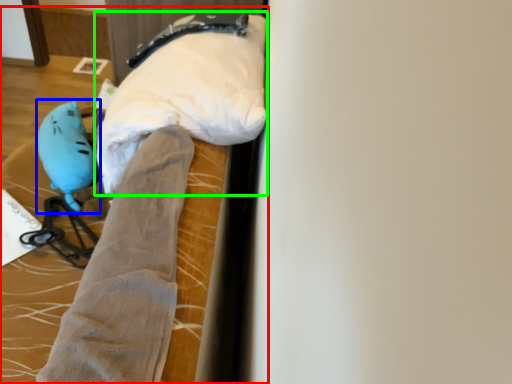
Question: Based on their relative distances, which object is farther from bed (highlighted by a red box)? Choose from toy (highlighted by a blue box) and wide (highlighted by a green box).

Choices:
 (A) toy
 (B) wide

Answer: (B)